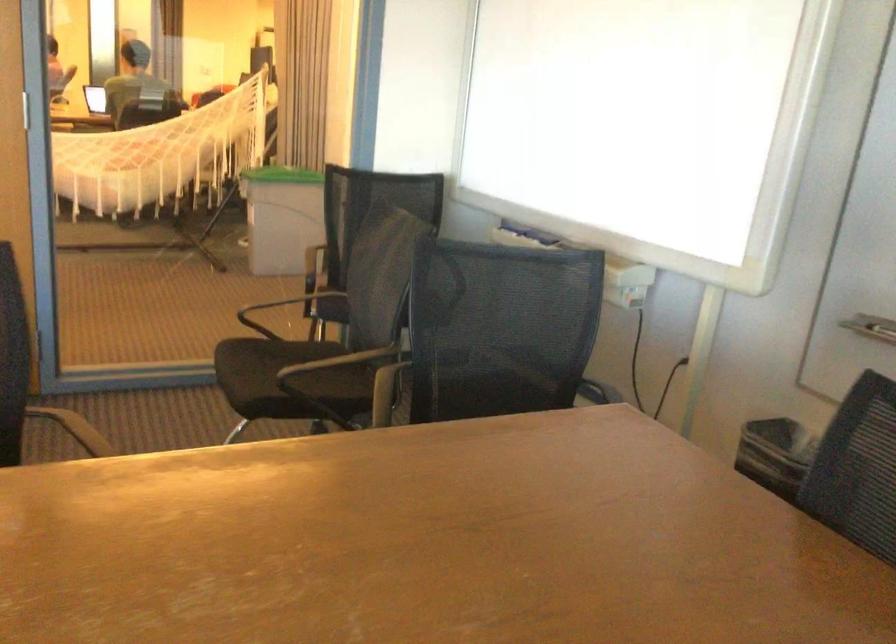
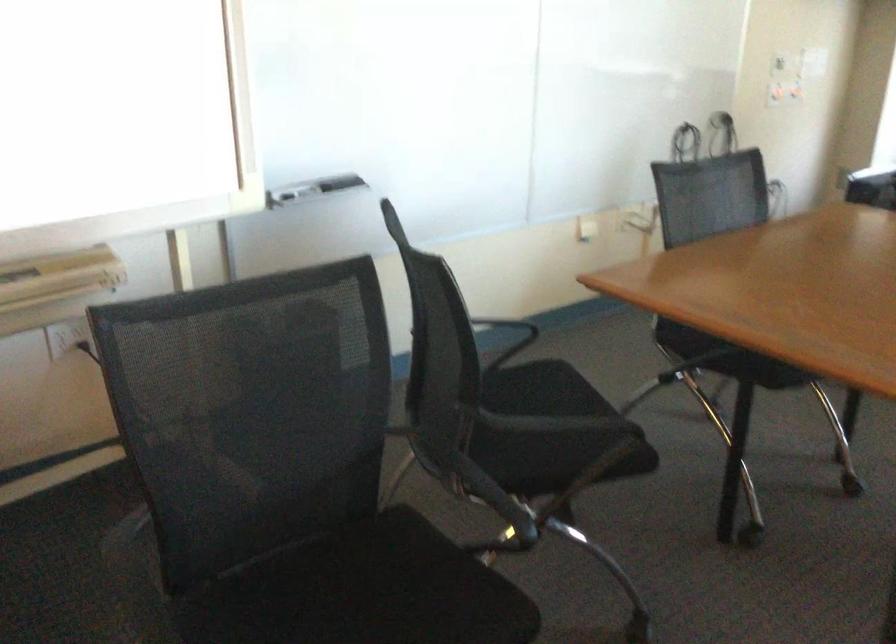
Find the pixel in the second image that matches (309,381) in the first image.

(363, 592)